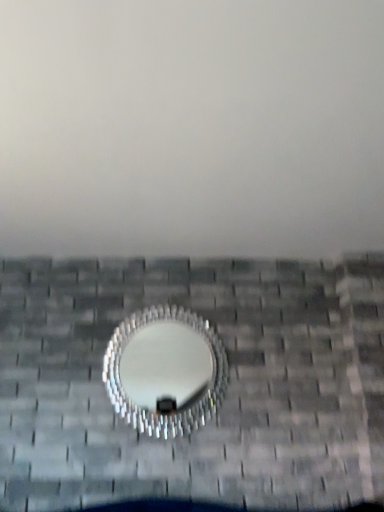
The width and height of the screenshot is (384, 512). Identify the location of white matte wall at upper center. (192, 128).

This screenshot has height=512, width=384. What do you see at coordinates (192, 128) in the screenshot? I see `white matte wall at upper center` at bounding box center [192, 128].

Locate an element on the screen. white matte wall at upper center is located at coordinates click(192, 128).